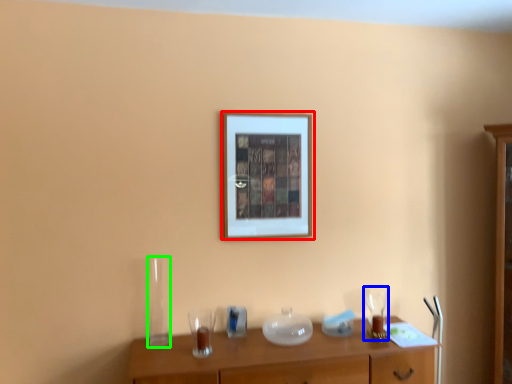
Question: Which is farther away from picture frame (highlighted by a red box)? wine glass (highlighted by a blue box) or glass vase (highlighted by a green box)?

Choices:
 (A) wine glass
 (B) glass vase

Answer: (A)